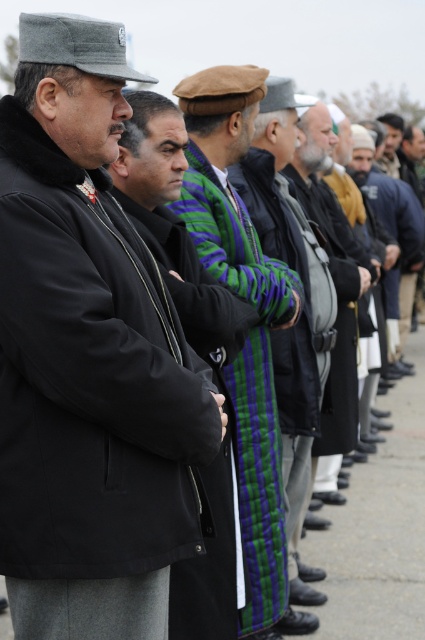
Measure the distance from green striped robe at center to striped wool sweater at center.

green striped robe at center is 4.76 feet away from striped wool sweater at center.

This screenshot has height=640, width=425. I want to click on green striped robe at center, so click(x=248, y=374).

Is point (277, 131) behind point (342, 371)?

That is False.

Between green striped scarf at center and striped wool sweater at center, which one appears on the right side from the viewer's perspective?

striped wool sweater at center is more to the right.

Is point (326, 269) behind point (336, 365)?

No, (326, 269) is closer to viewer.

Image resolution: width=425 pixels, height=640 pixels. Identify the location of green striped scarf at center. (299, 275).

Who is shorter, green striped robe at center or green striped scarf at center?

green striped robe at center

The height and width of the screenshot is (640, 425). What do you see at coordinates (248, 374) in the screenshot?
I see `green striped robe at center` at bounding box center [248, 374].

What are the coordinates of `green striped robe at center` in the screenshot? It's located at (248, 374).

At what (x,y) coordinates should I click in order to perform the action: click on green striped robe at center. Please return your answer as a coordinate pair (x, y). This screenshot has height=640, width=425. Looking at the image, I should click on (248, 374).